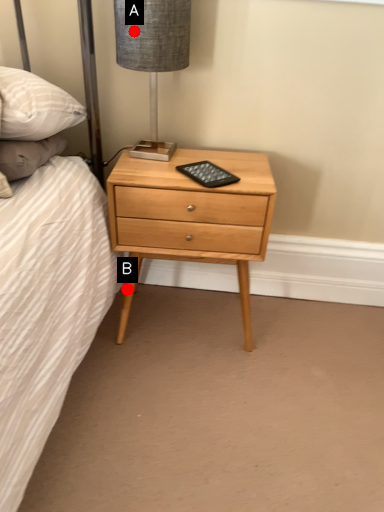
Question: Two points are circled on the image, labeled by A and B beside each circle. Which point is farther to the camera?

Choices:
 (A) A is further
 (B) B is further

Answer: (B)